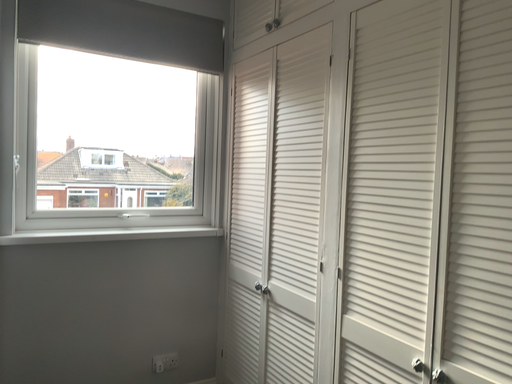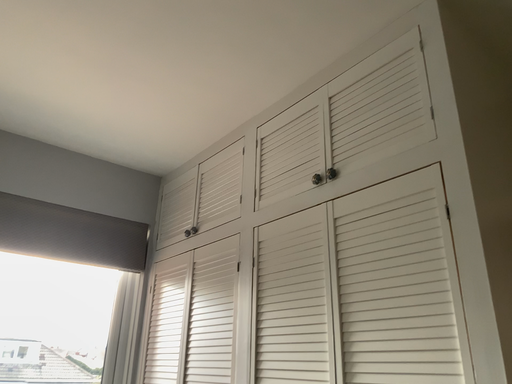
Question: How did the camera likely rotate when shooting the video?

Choices:
 (A) rotated right
 (B) rotated left

Answer: (A)